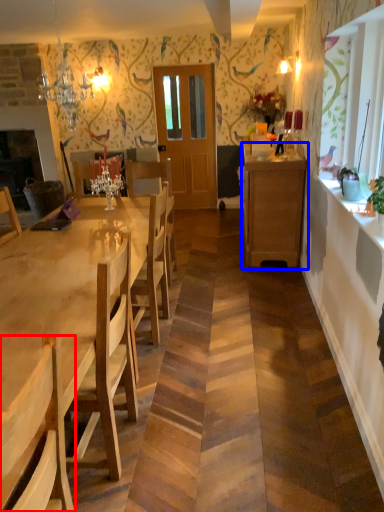
Question: Which object is further to the camera taking this photo, chair (highlighted by a red box) or cabinetry (highlighted by a blue box)?

Choices:
 (A) chair
 (B) cabinetry

Answer: (B)